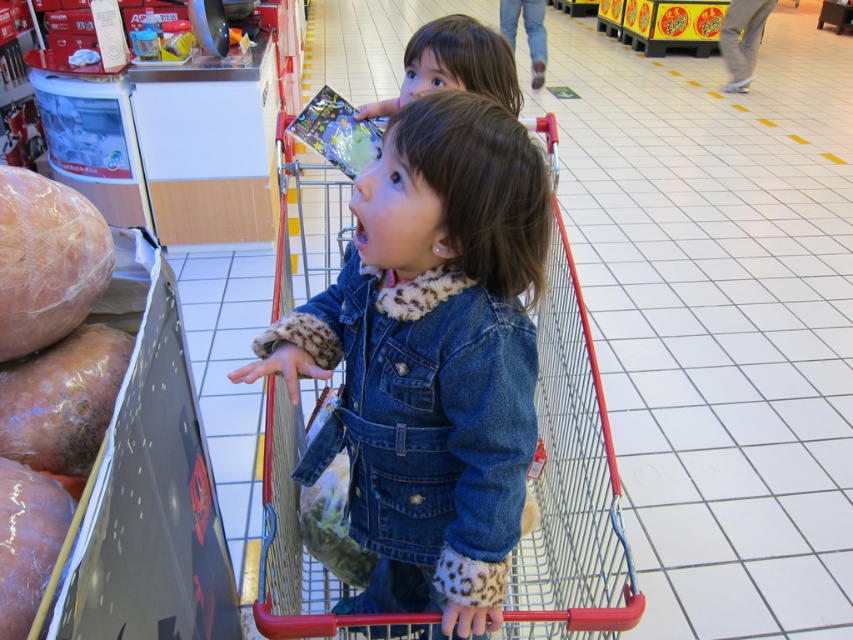
Does denim jacket at lower right appear on the left side of smooth brown sausage at left?

Incorrect, denim jacket at lower right is not on the left side of smooth brown sausage at left.

Between point (410, 372) and point (0, 333), which one is positioned in front?

Point (0, 333)

Who is more forward, (344, 403) or (90, 253)?

Point (90, 253) is more forward.

Where is `denim jacket at lower right`? denim jacket at lower right is located at coordinates (422, 408).

Is metallic red shopping cart at center shorter than smooth brown sausage at left?

No, metallic red shopping cart at center is not shorter than smooth brown sausage at left.

Is metallic red shopping cart at center thinner than smooth brown sausage at left?

In fact, metallic red shopping cart at center might be wider than smooth brown sausage at left.

In the scene shown: Who is more forward, (407, 451) or (53, 252)?

Point (53, 252)

You are a GUI agent. You are given a task and a screenshot of the screen. Output one action in this format:
    pyautogui.click(x=<x>, y=<y>)
    Task: Click on the metallic red shopping cart at center
    Image resolution: width=853 pixels, height=640 pixels.
    Given the screenshot: What is the action you would take?
    pyautogui.click(x=431, y=356)

Who is higher up, metallic red shopping cart at center or denim jacket at lower right?

denim jacket at lower right

Is point (383, 392) farther from viewer compared to point (509, 392)?

Yes, point (383, 392) is farther from viewer.

Between point (460, 273) and point (347, 268), which one is positioned behind?

Point (347, 268)

Locate an element on the screen. metallic red shopping cart at center is located at coordinates (431, 356).